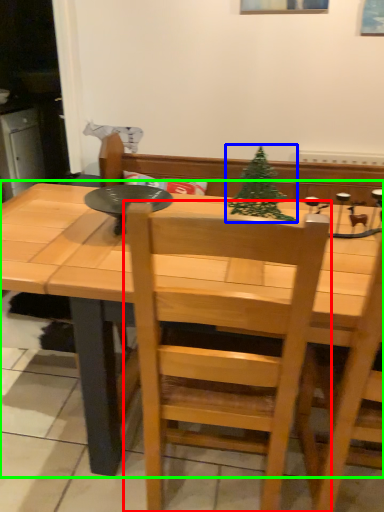
Question: Based on their relative distances, which object is farther from chair (highlighted by a red box)? Choose from christmas tree (highlighted by a blue box) and table (highlighted by a green box).

Choices:
 (A) christmas tree
 (B) table

Answer: (A)